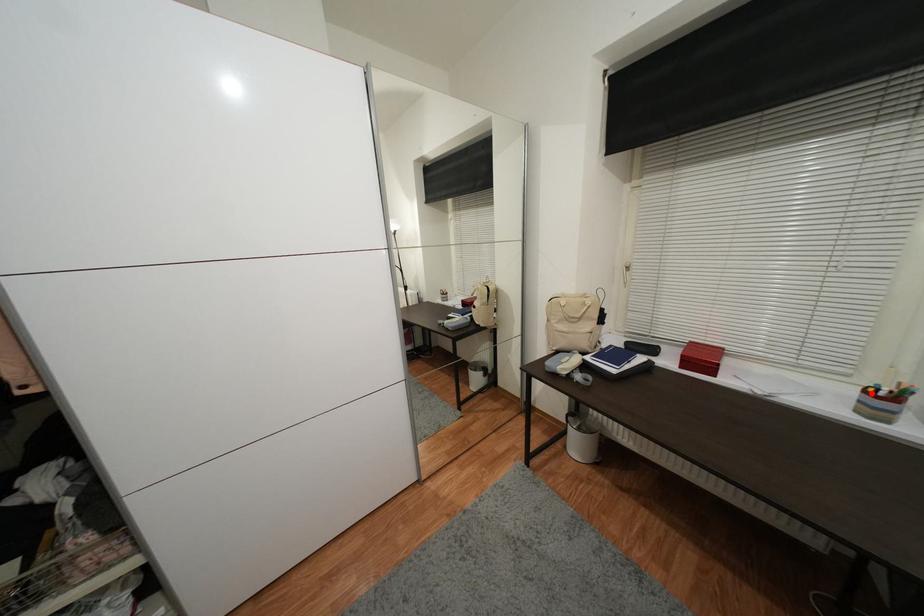
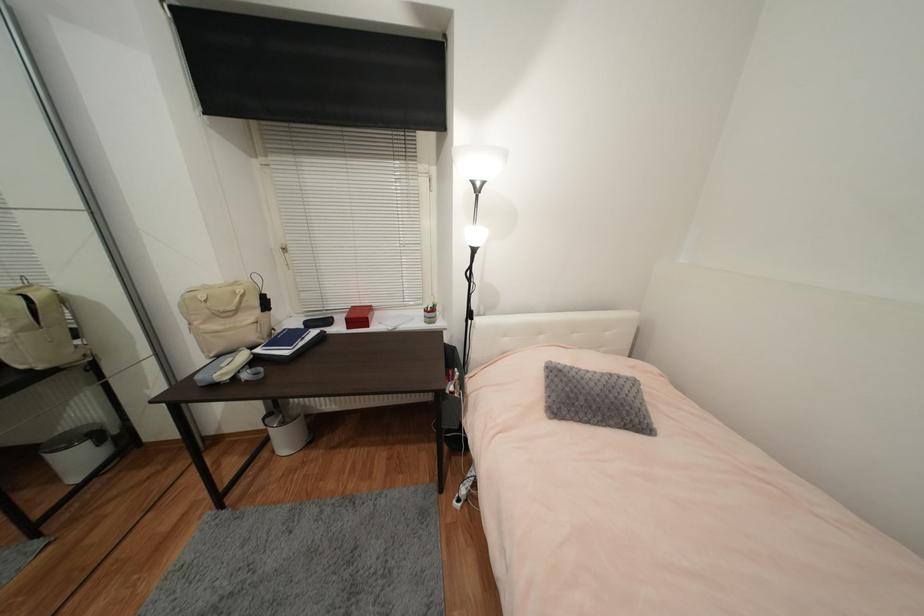
Question: I am providing you with two images of the same scene from different viewpoints. In image1, a red point is highlighted. Considering the same 3D point in image2, which of the following is correct?

Choices:
 (A) It is closer
 (B) It is farther

Answer: (A)